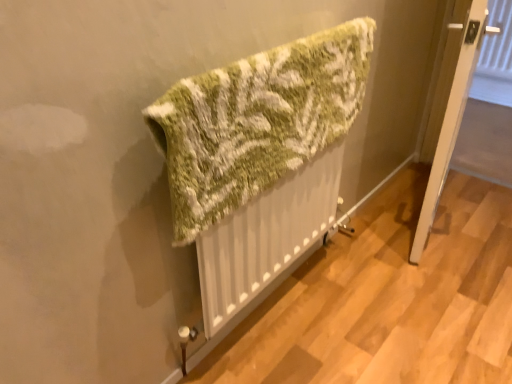
What do you see at coordinates (451, 124) in the screenshot?
I see `white wooden door at lower right` at bounding box center [451, 124].

Find the location of `white wooden door at lower right`. white wooden door at lower right is located at coordinates (451, 124).

What are the coordinates of `green knitted towel at center` in the screenshot? It's located at (257, 121).

In order to face green knitted towel at center, should I rotate leftwards or rightwards?

Rotate your view right by about 3.748°.

Describe the element at coordinates (257, 121) in the screenshot. The height and width of the screenshot is (384, 512). I see `green knitted towel at center` at that location.

You are a GUI agent. You are given a task and a screenshot of the screen. Output one action in this format:
    pyautogui.click(x=<x>, y=<y>)
    Task: Click on the white wooden door at lower right
    This screenshot has width=512, height=384.
    Given the screenshot: What is the action you would take?
    (x=451, y=124)

Is white wooden door at lower right at the left side of green knitted towel at center?

No, white wooden door at lower right is not to the left of green knitted towel at center.

Which is behind, white wooden door at lower right or green knitted towel at center?

white wooden door at lower right is further from the camera.

Which is further, (448, 109) or (231, 78)?

Point (448, 109)

Consider the image. From the image's perspective, is white wooden door at lower right below green knitted towel at center?

Actually, white wooden door at lower right appears above green knitted towel at center in the image.

From a real-world perspective, is white wooden door at lower right located higher than green knitted towel at center?

No, from a real-world perspective, white wooden door at lower right is not above green knitted towel at center.

Looking at their sizes, would you say white wooden door at lower right is wider or thinner than green knitted towel at center?

white wooden door at lower right is wider than green knitted towel at center.

Can you confirm if white wooden door at lower right is taller than green knitted towel at center?

Yes.

Can you confirm if white wooden door at lower right is bigger than green knitted towel at center?

Yes, white wooden door at lower right is bigger than green knitted towel at center.

Is white wooden door at lower right situated inside green knitted towel at center or outside?

white wooden door at lower right lies outside green knitted towel at center.

Is white wooden door at lower right beside green knitted towel at center?

No, white wooden door at lower right is not making contact with green knitted towel at center.

Consider the image. Is white wooden door at lower right positioned with its back to green knitted towel at center?

That's not correct — white wooden door at lower right is not looking away from green knitted towel at center.

How different are the orientations of white wooden door at lower right and green knitted towel at center in degrees?

14.3 degrees.

Measure the distance between white wooden door at lower right and green knitted towel at center.

white wooden door at lower right is 22.63 inches from green knitted towel at center.

Find the location of `door behind the green knitted towel at center`. door behind the green knitted towel at center is located at coordinates (451, 124).

Considering the positions of objects green knitted towel at center and white wooden door at lower right in the image provided, who is more to the right, green knitted towel at center or white wooden door at lower right?

white wooden door at lower right is more to the right.

Which is behind, green knitted towel at center or white wooden door at lower right?

white wooden door at lower right.

Is point (317, 54) positioned behind point (424, 235)?

No, (317, 54) is closer to viewer.

From the image's perspective, who appears lower, green knitted towel at center or white wooden door at lower right?

green knitted towel at center appears lower in the image.

From a real-world perspective, is green knitted towel at center physically located above or below white wooden door at lower right?

green knitted towel at center is situated higher than white wooden door at lower right in the real world.

Which of these two, green knitted towel at center or white wooden door at lower right, is thinner?

green knitted towel at center is thinner.

Looking at this image, who is shorter, green knitted towel at center or white wooden door at lower right?

green knitted towel at center.

Which of these two, green knitted towel at center or white wooden door at lower right, is bigger?

white wooden door at lower right.

In the scene shown: Is white wooden door at lower right inside green knitted towel at center?

Definitely not — white wooden door at lower right is not inside green knitted towel at center.

Are green knitted towel at center and white wooden door at lower right making contact?

They are not placed beside each other.

Looking at this image, does green knitted towel at center turn towards white wooden door at lower right?

No, green knitted towel at center is not oriented towards white wooden door at lower right.

Measure the distance from green knitted towel at center to white wooden door at lower right.

The distance of green knitted towel at center from white wooden door at lower right is 22.63 inches.

Where is `towel below the white wooden door at lower right (from the image's perspective)`? towel below the white wooden door at lower right (from the image's perspective) is located at coordinates (257, 121).

Where is `door below the green knitted towel at center (from a real-world perspective)`? door below the green knitted towel at center (from a real-world perspective) is located at coordinates (451, 124).

Locate an element on the screen. The width and height of the screenshot is (512, 384). door that is above the green knitted towel at center (from the image's perspective) is located at coordinates (451, 124).